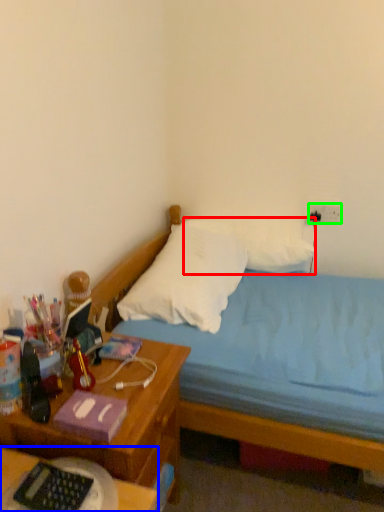
Question: Which object is the farthest from pillow (highlighted by a red box)? Choose among these: desk (highlighted by a blue box) or electric outlet (highlighted by a green box).

Choices:
 (A) desk
 (B) electric outlet

Answer: (A)